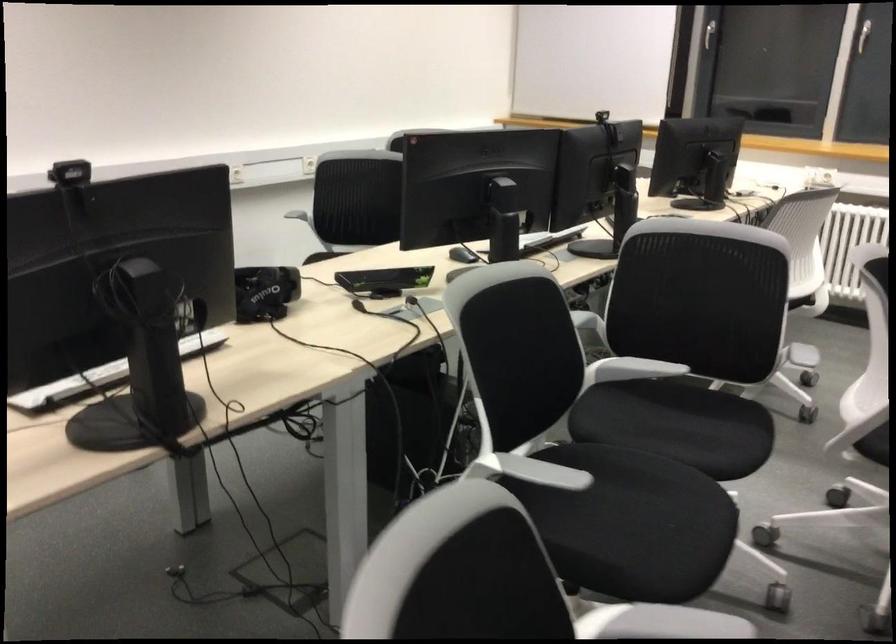
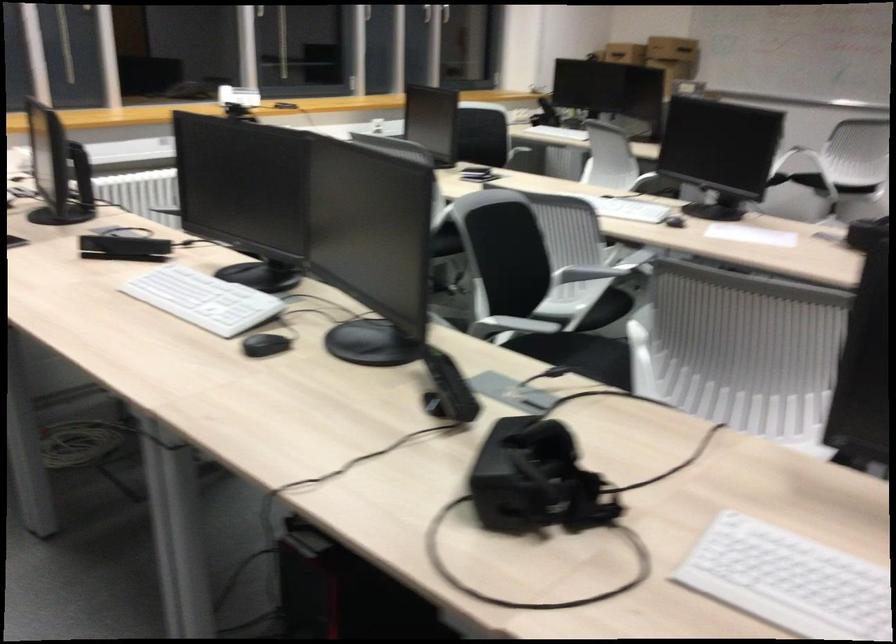
In the second image, find the point that corresponds to (x=457, y=256) in the first image.

(264, 345)